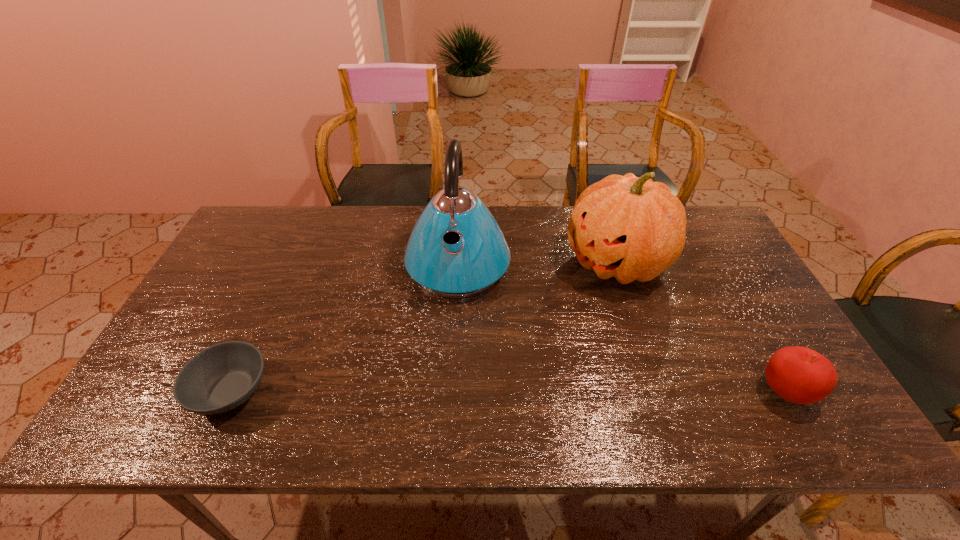
This screenshot has width=960, height=540. I want to click on object that is at the left edge, so click(x=222, y=377).

Image resolution: width=960 pixels, height=540 pixels. Find the location of `object at the right edge`. object at the right edge is located at coordinates (799, 375).

Locate an element on the screen. Image resolution: width=960 pixels, height=540 pixels. object located at the near left corner is located at coordinates (222, 377).

I want to click on object present at the near right corner, so click(799, 375).

Find the location of `free space at the far edge of the desktop`. free space at the far edge of the desktop is located at coordinates (507, 214).

This screenshot has height=540, width=960. In the image, there is a desktop. Identify the location of vacant space at the near edge. (626, 396).

Where is `free location at the left edge`? free location at the left edge is located at coordinates (237, 259).

Find the location of a particular element. The width and height of the screenshot is (960, 540). vacant space at the right edge is located at coordinates [x=732, y=292].

Where is `vacant space at the far right corner of the desktop`? This screenshot has height=540, width=960. vacant space at the far right corner of the desktop is located at coordinates pos(686,233).

Where is `vacant area at the near right corner`? vacant area at the near right corner is located at coordinates (756, 377).